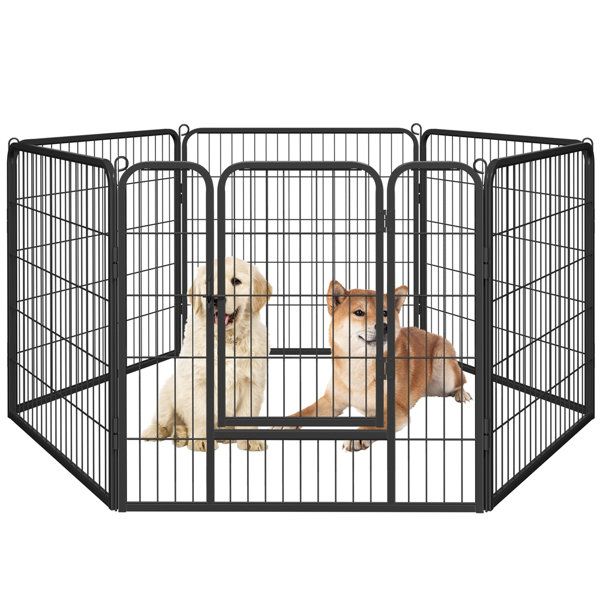
This screenshot has width=600, height=600. Identify the location of hinge. (380, 243).